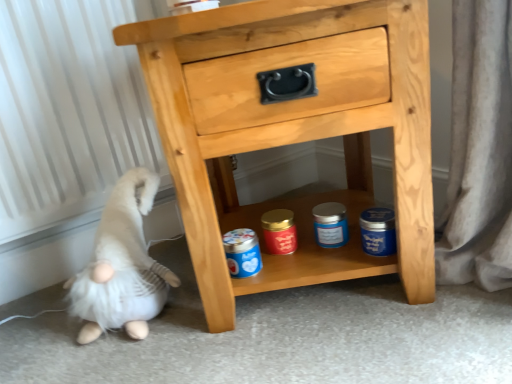
Identify the location of free space in front of white plush gnome at lower left. This screenshot has height=384, width=512. (125, 361).